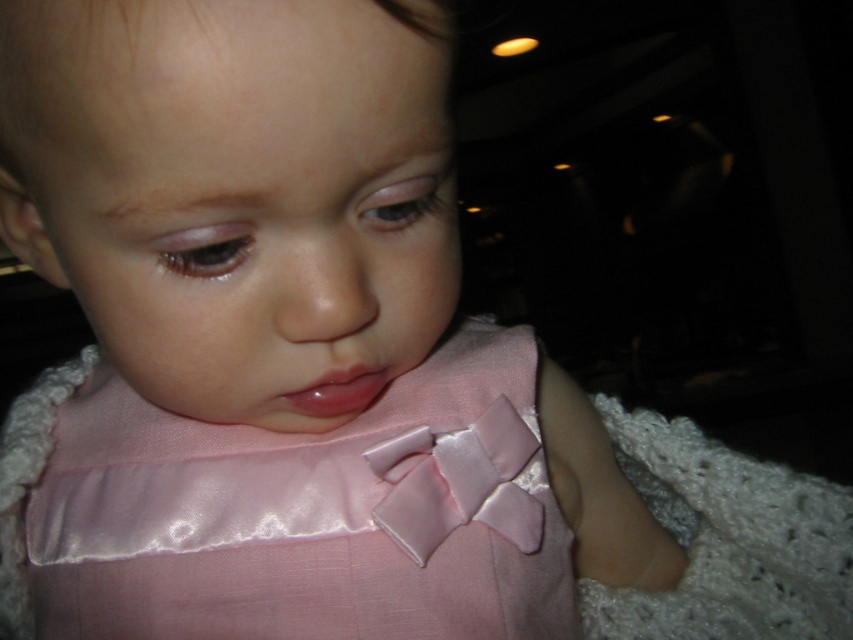
Question: Considering the relative positions of satin pink dress at center and glossy pink lips at center in the image provided, where is satin pink dress at center located with respect to glossy pink lips at center?

Choices:
 (A) below
 (B) above

Answer: (A)

Question: Is satin pink dress at center bigger than glossy pink lips at center?

Choices:
 (A) yes
 (B) no

Answer: (A)

Question: Which object appears closest to the camera in this image?

Choices:
 (A) satin pink dress at center
 (B) glossy pink lips at center

Answer: (B)

Question: Can you confirm if satin pink dress at center is wider than glossy pink lips at center?

Choices:
 (A) no
 (B) yes

Answer: (B)

Question: Which object appears farthest from the camera in this image?

Choices:
 (A) satin pink dress at center
 (B) glossy pink lips at center

Answer: (A)

Question: Which point is closer to the camera?

Choices:
 (A) glossy pink lips at center
 (B) satin pink dress at center

Answer: (A)